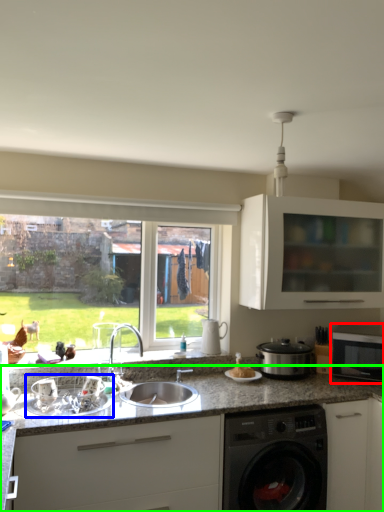
Question: Which object is positioned closest to microwave oven (highlighted by a red box)? Select from appliance (highlighted by a blue box) and countertop (highlighted by a green box).

Choices:
 (A) appliance
 (B) countertop

Answer: (B)